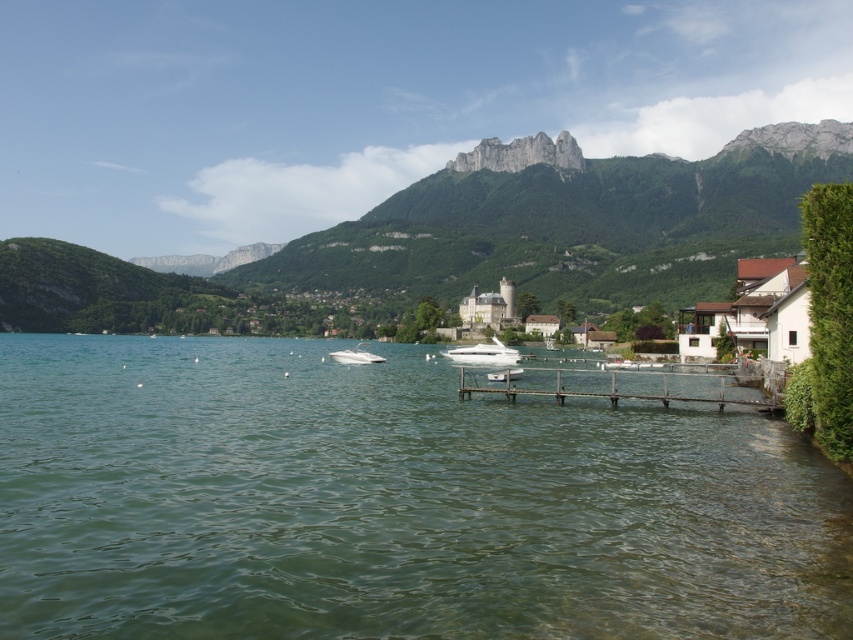
You are an observer standing at the lakeside. You notice the green water at center and the green grassy mountain at upper center. Which of these two objects appears narrower in the image?

The green water at center appears narrower than the green grassy mountain at upper center.

You are standing at the edge of the lake and want to throw a stone into the green water at center. If your throwing range is 25 meters, will you be able to reach it?

The green water at center is 24.25 meters away from the viewer, so yes, you can reach it with your throwing range of 25 meters.

You are standing at the lakeside and want to take a photo of the green grassy mountain at upper center and the white glossy boat at center. Which object should you focus on first to ensure both are in sharp focus?

You should focus on the green grassy mountain at upper center first because it is closer to you than the white glossy boat at center. By focusing on the closer object, the boat will also be in focus due to the depth of field.